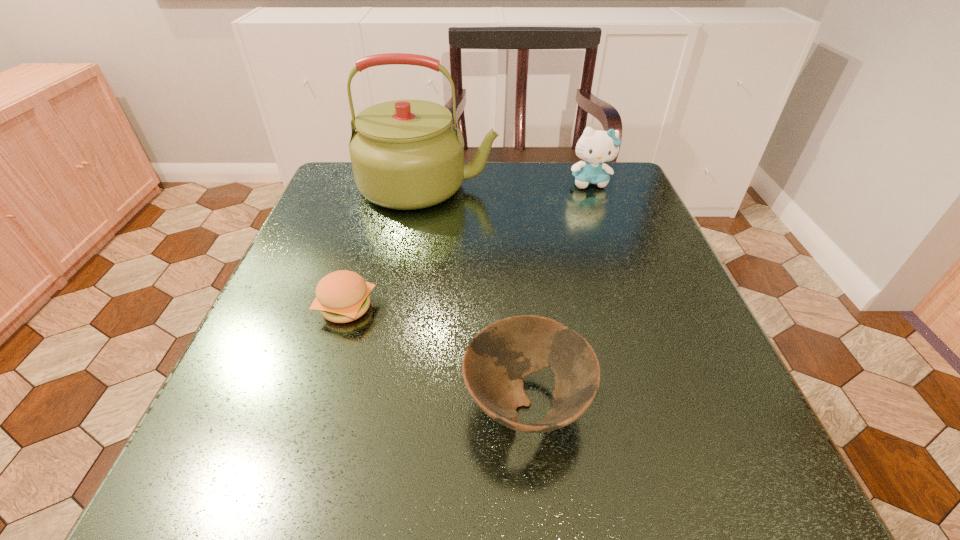
Find the location of a particular element. blank space at the near edge of the desktop is located at coordinates (437, 466).

What are the coordinates of `vacant space at the left edge of the desktop` in the screenshot? It's located at (336, 324).

Locate an element on the screen. free spot at the right edge of the desktop is located at coordinates (588, 247).

Image resolution: width=960 pixels, height=540 pixels. Find the location of `free point at the near left corner`. free point at the near left corner is located at coordinates pyautogui.click(x=167, y=502).

Where is `vacant space at the far right corner of the desktop`? This screenshot has height=540, width=960. vacant space at the far right corner of the desktop is located at coordinates (619, 205).

The image size is (960, 540). In order to click on free spot between the third shortest object and the nearest object in this screenshot , I will do `click(558, 293)`.

Find the location of a particular element. unoccupied area between the hamburger and the second tallest object is located at coordinates (468, 245).

What are the coordinates of `free point between the kettle and the second nearest object` in the screenshot? It's located at (387, 247).

The height and width of the screenshot is (540, 960). What are the coordinates of `free spot between the nearest object and the kitten` in the screenshot? It's located at (558, 293).

Where is `unoccupied position between the bowl and the tallest object`? The height and width of the screenshot is (540, 960). unoccupied position between the bowl and the tallest object is located at coordinates (477, 295).